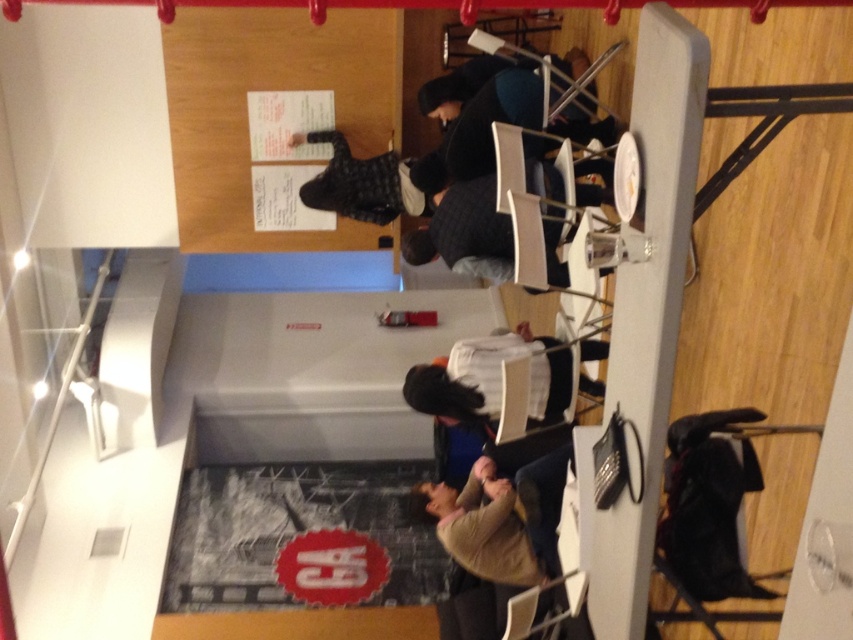
I want to click on checkered fabric jacket at center, so click(366, 182).

Between point (519, 509) and point (346, 196), which one is positioned behind?

Point (346, 196)

Does light brown sweater at lower center appear on the left side of checkered fabric jacket at center?

In fact, light brown sweater at lower center is to the right of checkered fabric jacket at center.

Measure the distance between point [535,483] and camera.

The distance of point [535,483] from camera is 3.76 meters.

You are a GUI agent. You are given a task and a screenshot of the screen. Output one action in this format:
    pyautogui.click(x=<x>, y=<y>)
    Task: Click on the light brown sweater at lower center
    Image resolution: width=853 pixels, height=640 pixels.
    Given the screenshot: What is the action you would take?
    pyautogui.click(x=502, y=518)

Does white fabric shirt at center have a greater width compared to checkered fabric jacket at center?

Correct, the width of white fabric shirt at center exceeds that of checkered fabric jacket at center.

Image resolution: width=853 pixels, height=640 pixels. What do you see at coordinates (491, 378) in the screenshot?
I see `white fabric shirt at center` at bounding box center [491, 378].

Where is `white fabric shirt at center`? white fabric shirt at center is located at coordinates (491, 378).